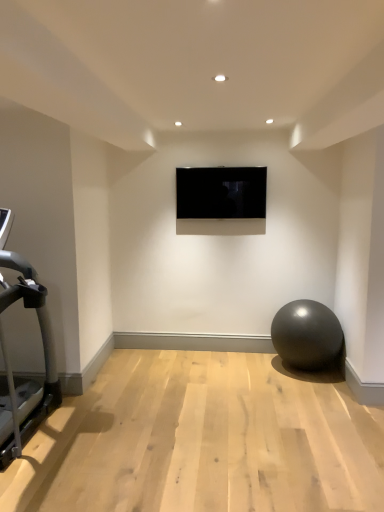
Question: Is black glossy tv at center not within glossy rubber ball at lower right?

Choices:
 (A) yes
 (B) no

Answer: (A)

Question: Is black glossy tv at center shorter than glossy rubber ball at lower right?

Choices:
 (A) yes
 (B) no

Answer: (A)

Question: Considering the relative positions of black glossy tv at center and glossy rubber ball at lower right in the image provided, is black glossy tv at center to the right of glossy rubber ball at lower right from the viewer's perspective?

Choices:
 (A) no
 (B) yes

Answer: (A)

Question: From a real-world perspective, is black glossy tv at center positioned over glossy rubber ball at lower right based on gravity?

Choices:
 (A) no
 (B) yes

Answer: (B)

Question: Is there a large distance between black glossy tv at center and glossy rubber ball at lower right?

Choices:
 (A) no
 (B) yes

Answer: (B)

Question: From their relative heights in the image, would you say glossy rubber ball at lower right is taller or shorter than silver metallic treadmill at left?

Choices:
 (A) short
 (B) tall

Answer: (A)

Question: From the image's perspective, relative to silver metallic treadmill at left, is glossy rubber ball at lower right above or below?

Choices:
 (A) above
 (B) below

Answer: (B)

Question: Based on their sizes in the image, would you say glossy rubber ball at lower right is bigger or smaller than silver metallic treadmill at left?

Choices:
 (A) big
 (B) small

Answer: (B)

Question: From a real-world perspective, is glossy rubber ball at lower right physically located above or below silver metallic treadmill at left?

Choices:
 (A) below
 (B) above

Answer: (A)

Question: Considering their positions, is black glossy tv at center located in front of or behind glossy rubber ball at lower right?

Choices:
 (A) front
 (B) behind

Answer: (B)

Question: Is black glossy tv at center spatially inside glossy rubber ball at lower right, or outside of it?

Choices:
 (A) outside
 (B) inside

Answer: (A)

Question: Is black glossy tv at center wider or thinner than glossy rubber ball at lower right?

Choices:
 (A) wide
 (B) thin

Answer: (B)

Question: Considering the positions of black glossy tv at center and glossy rubber ball at lower right in the image, is black glossy tv at center bigger or smaller than glossy rubber ball at lower right?

Choices:
 (A) big
 (B) small

Answer: (B)

Question: From the image's perspective, is silver metallic treadmill at left positioned above or below glossy rubber ball at lower right?

Choices:
 (A) below
 (B) above

Answer: (B)

Question: Based on their sizes in the image, would you say silver metallic treadmill at left is bigger or smaller than glossy rubber ball at lower right?

Choices:
 (A) small
 (B) big

Answer: (B)